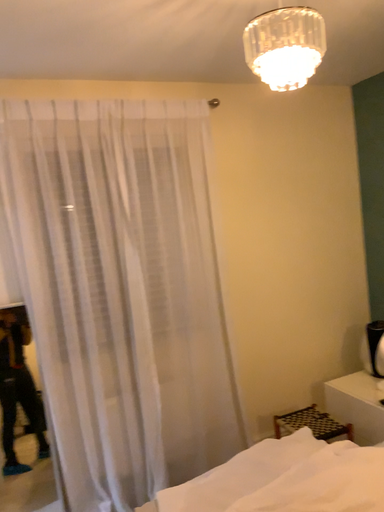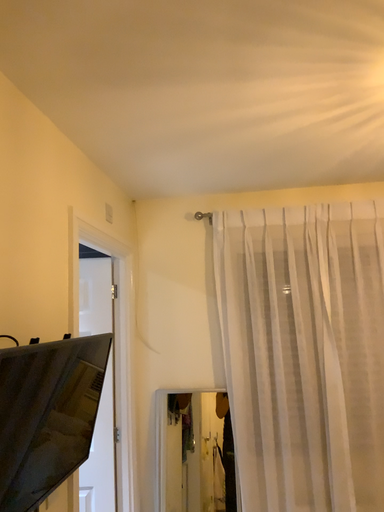
Question: Which way did the camera rotate in the video?

Choices:
 (A) rotated left
 (B) rotated right

Answer: (A)